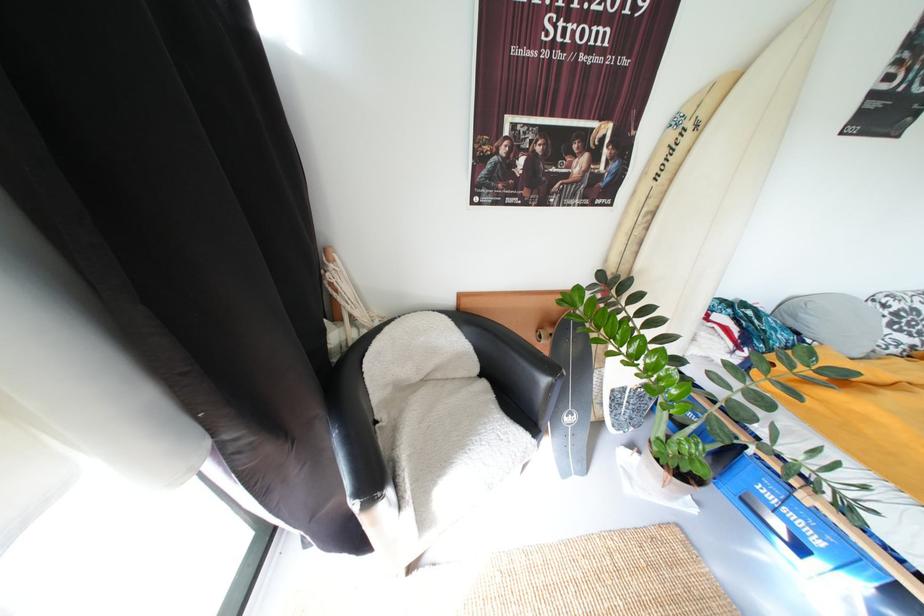
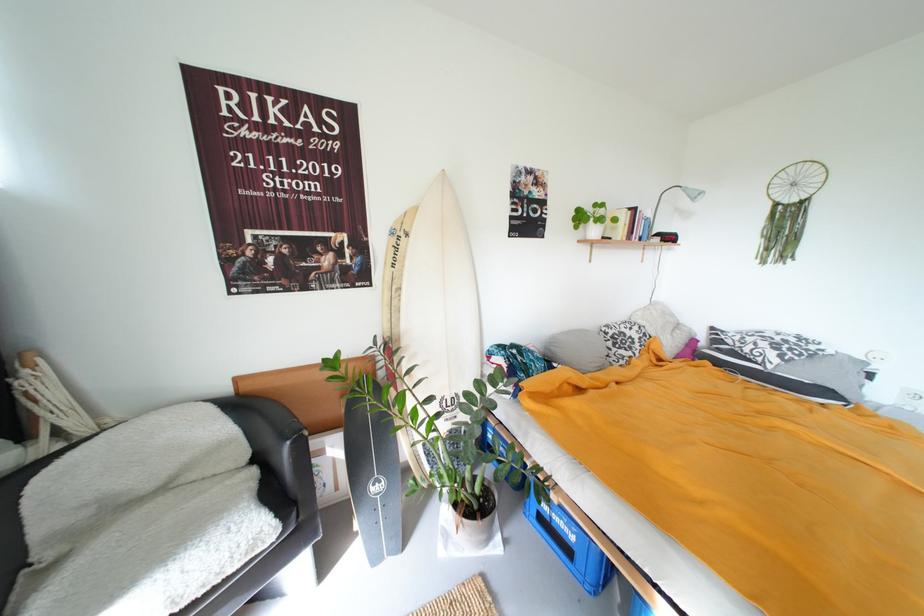
Find the pixel in the second image that matches point (894, 309) in the first image.

(614, 334)